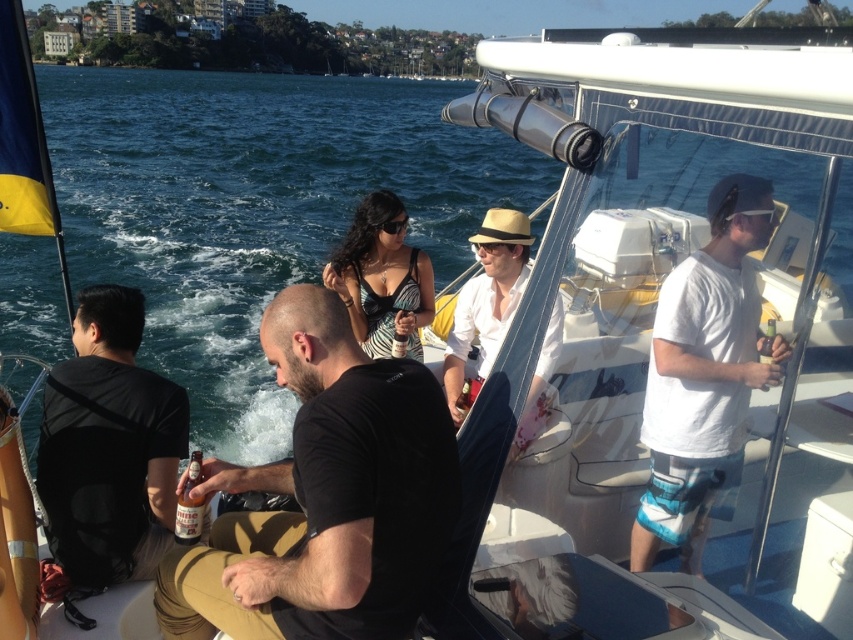
Can you confirm if black matte shirt at center is positioned above zebra print dress at center?

No.

Which is above, black matte shirt at center or zebra print dress at center?

zebra print dress at center is higher up.

Measure the distance between point (376,552) and camera.

The distance of point (376,552) from camera is 2.90 meters.

Where is `black matte shirt at center`? Image resolution: width=853 pixels, height=640 pixels. black matte shirt at center is located at coordinates (325, 497).

Is black matte shirt at left thinner than matte straw hat at center?

No, black matte shirt at left is not thinner than matte straw hat at center.

Which is in front, point (38, 476) or point (448, 349)?

Point (38, 476)

You are a GUI agent. You are given a task and a screenshot of the screen. Output one action in this format:
    pyautogui.click(x=<x>, y=<y>)
    Task: Click on the black matte shirt at left
    
    Given the screenshot: What is the action you would take?
    pyautogui.click(x=109, y=445)

Which of these two, black matte shirt at center or black matte shirt at left, stands taller?

black matte shirt at center

Between point (170, 630) and point (175, 444), which one is positioned behind?

The point (175, 444) is more distant.

The height and width of the screenshot is (640, 853). I want to click on black matte shirt at center, so click(325, 497).